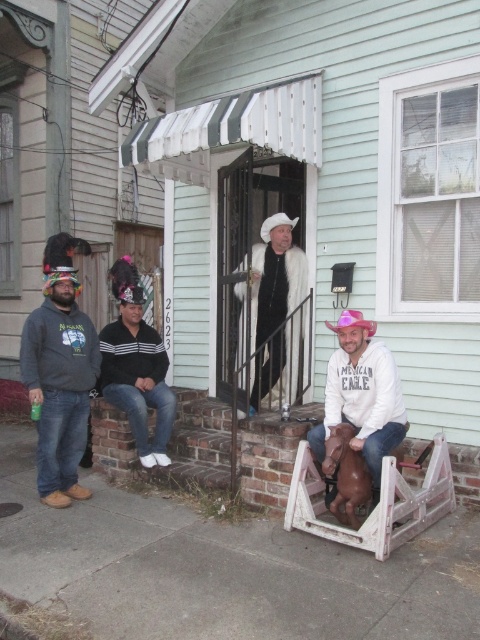
Question: Is matte gray hoodie at left bigger than black striped sweater at center?

Choices:
 (A) no
 (B) yes

Answer: (A)

Question: Among these points, which one is nearest to the camera?

Choices:
 (A) (72, 420)
 (B) (340, 364)

Answer: (B)

Question: Can you confirm if matte gray hoodie at left is bigger than white cotton hoodie at lower center?

Choices:
 (A) yes
 (B) no

Answer: (A)

Question: Which object is the farthest from the white cotton hoodie at lower center?

Choices:
 (A) white fur coat at center
 (B) matte gray hoodie at left
 (C) black striped sweater at center

Answer: (B)

Question: Estimate the real-world distances between objects in this image. Which object is farther from the black striped sweater at center?

Choices:
 (A) white cotton hoodie at lower center
 (B) white fur coat at center

Answer: (A)

Question: Observing the image, what is the correct spatial positioning of matte gray hoodie at left in reference to white cotton hoodie at lower center?

Choices:
 (A) below
 (B) above

Answer: (B)